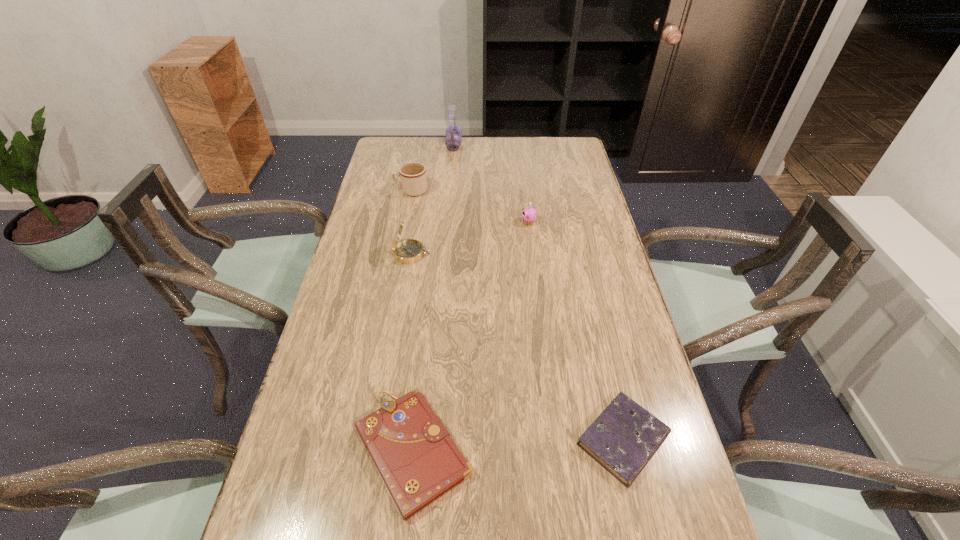
Identify the location of vacant space located 0.320m on the headband and ear cups of the headset. (540, 145).

Locate an element on the screen. The image size is (960, 540). free space located with the dial facing the third nearest object is located at coordinates coord(482,254).

Locate an element on the screen. The height and width of the screenshot is (540, 960). free region located on the side of the mug with the handle is located at coordinates (380, 191).

Locate an element on the screen. vacant space situated 0.050m on the side of the mug with the handle is located at coordinates click(380, 191).

Find the location of a particular element. This screenshot has height=540, width=960. vacant space located 0.100m on the side of the mug with the handle is located at coordinates (367, 191).

Where is `vacant space located on the face of the fifth object from left to right`? This screenshot has width=960, height=540. vacant space located on the face of the fifth object from left to right is located at coordinates (421, 222).

Where is `free region located 0.310m on the face of the fifth object from left to right`? The width and height of the screenshot is (960, 540). free region located 0.310m on the face of the fifth object from left to right is located at coordinates (427, 222).

Locate an element on the screen. This screenshot has height=540, width=960. vacant region located on the face of the fifth object from left to right is located at coordinates (491, 222).

Where is `free region located on the right of the notebook`? free region located on the right of the notebook is located at coordinates (x=507, y=451).

Where is `free location located on the back of the rightmost object`? The image size is (960, 540). free location located on the back of the rightmost object is located at coordinates (600, 344).